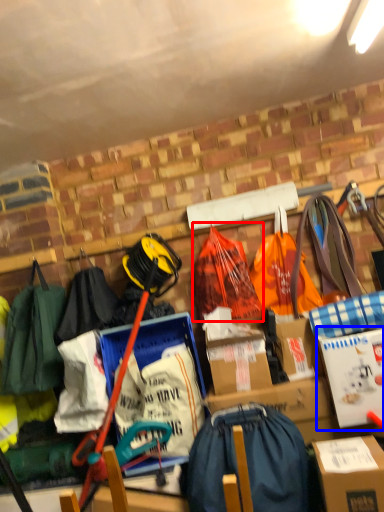
Question: Which of the following is the closest to the observer, grocery bag (highlighted by a red box) or cardboard box (highlighted by a blue box)?

Choices:
 (A) grocery bag
 (B) cardboard box

Answer: (B)